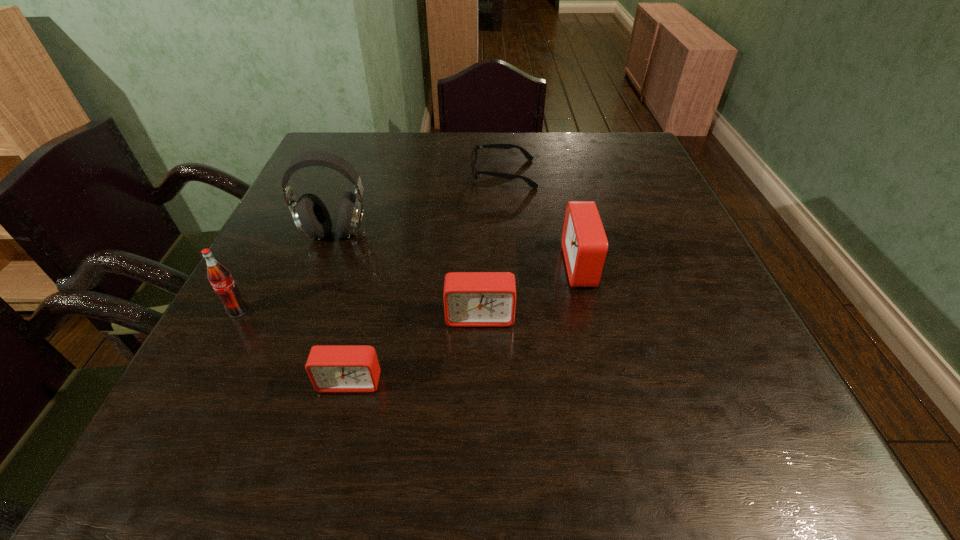
Locate an element on the screen. Image resolution: width=960 pixels, height=540 pixels. object that is the fourth closest to the shortest object is located at coordinates (331, 368).

Find the location of a particular element. Image resolution: width=960 pixels, height=540 pixels. object that is the second closest one to the shortest alarm clock is located at coordinates (220, 278).

Locate an element on the screen. the closest alarm clock relative to the nearest object is located at coordinates (471, 299).

This screenshot has width=960, height=540. I want to click on alarm clock that is the second closest to the rightmost object, so click(331, 368).

Find the location of `free space that satisfies the following two spatial constraints: 1. on the front-facing side of the shortest object; 2. on the front-facing side of the nearest alarm clock`. free space that satisfies the following two spatial constraints: 1. on the front-facing side of the shortest object; 2. on the front-facing side of the nearest alarm clock is located at coordinates (518, 381).

You are a GUI agent. You are given a task and a screenshot of the screen. Output one action in this format:
    pyautogui.click(x=<x>, y=<y>)
    Task: Click on the free location that satisfies the following two spatial constraints: 1. on the front-facing side of the shortest object; 2. on the front-facing side of the leftmost alarm clock
    
    Given the screenshot: What is the action you would take?
    coord(518,381)

The height and width of the screenshot is (540, 960). I want to click on vacant region that satisfies the following two spatial constraints: 1. on the front-facing side of the third tallest object; 2. on the front-facing side of the second alarm clock from left to right, so click(593, 316).

Image resolution: width=960 pixels, height=540 pixels. Identify the location of vacant space that satisfies the following two spatial constraints: 1. on the front-facing side of the rightmost alarm clock; 2. on the front-facing side of the third shortest object. (593, 316).

Identify the location of free space that satisfies the following two spatial constraints: 1. on the front-facing side of the rightmost object; 2. on the front-facing side of the nearest object. (610, 381).

The width and height of the screenshot is (960, 540). I want to click on vacant space that satisfies the following two spatial constraints: 1. on the front-facing side of the farthest object; 2. on the label of the leftmost object, so click(x=514, y=311).